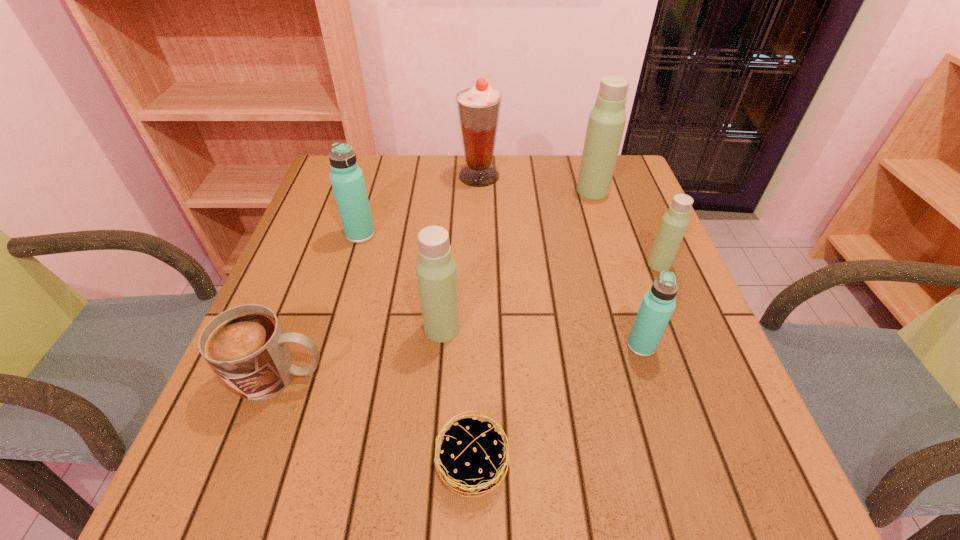
Locate an element on the screen. The width and height of the screenshot is (960, 540). free space between the bigger aqua thermos bottle and the patty is located at coordinates tap(417, 350).

At what (x,y) coordinates should I click in order to perform the action: click on unoccupied area between the mug and the smoothie. Please return your answer as a coordinate pair (x, y). This screenshot has height=540, width=960. Looking at the image, I should click on (380, 276).

The image size is (960, 540). I want to click on empty location between the third farthest object and the tallest thermos bottle, so click(x=476, y=213).

Find the location of a particular element. The height and width of the screenshot is (540, 960). free space between the sixth nearest object and the fifth nearest object is located at coordinates (510, 249).

Locate an element on the screen. vacant area that lies between the left aqua thermos bottle and the farthest light thermos bottle is located at coordinates (476, 213).

You are a GUI agent. You are given a task and a screenshot of the screen. Output one action in this format:
    pyautogui.click(x=<x>, y=<y>)
    Task: Click on the object that stands as the third closest to the rightmost light thermos bottle
    This screenshot has height=540, width=960.
    Given the screenshot: What is the action you would take?
    pyautogui.click(x=479, y=107)

Locate which object ranks fifth in proximity to the bigger aqua thermos bottle. Please provide its 2D coordinates. Your answer should be formatted as a tuple, i.e. [(x, y)], where the tuple contains the x and y coordinates of a point satisfying the conditions above.

[(607, 119)]

Point out which thermos bottle is positioned as the third nearest to the nearest object. Please provide its 2D coordinates. Your answer should be formatted as a tuple, i.e. [(x, y)], where the tuple contains the x and y coordinates of a point satisfying the conditions above.

[(674, 223)]

Where is `the second closest thermos bottle relative to the leftmost light thermos bottle`? The height and width of the screenshot is (540, 960). the second closest thermos bottle relative to the leftmost light thermos bottle is located at coordinates [658, 304].

In order to click on light thermos bottle that stands as the closest to the rightmost thermos bottle in this screenshot , I will do `click(607, 119)`.